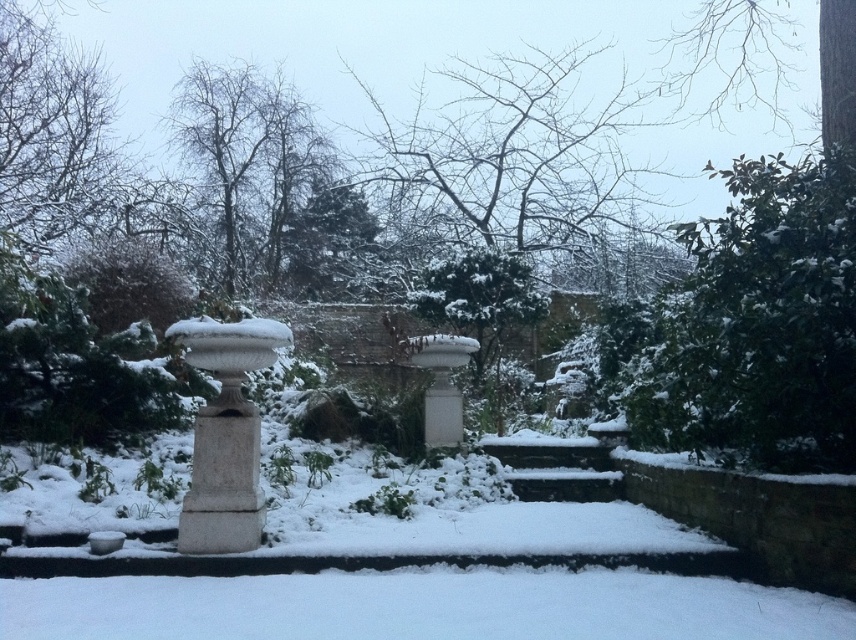
Question: Is white stone urn at left in front of white stone pillar at center?

Choices:
 (A) no
 (B) yes

Answer: (B)

Question: Which object appears farthest from the camera in this image?

Choices:
 (A) white stone urn at left
 (B) white stone pillar at center
 (C) green leafy tree at upper right

Answer: (B)

Question: Can you confirm if green leafy tree at upper right is smaller than white stone urn at left?

Choices:
 (A) no
 (B) yes

Answer: (A)

Question: Does white stone urn at left have a lesser width compared to white stone pillar at center?

Choices:
 (A) no
 (B) yes

Answer: (A)

Question: Estimate the real-world distances between objects in this image. Which object is closer to the white stone pillar at center?

Choices:
 (A) green leafy tree at upper right
 (B) white stone urn at left

Answer: (A)

Question: Which point appears farthest from the camera in this image?

Choices:
 (A) (450, 410)
 (B) (260, 326)
 (C) (831, 214)

Answer: (A)